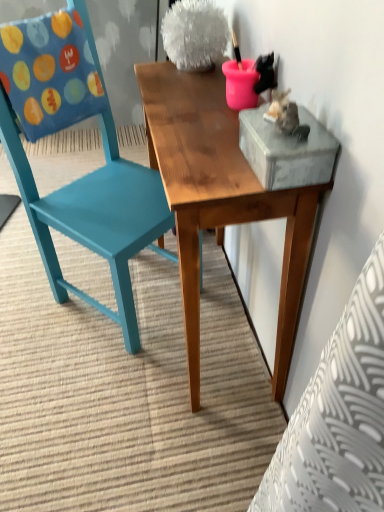
Find the location of a particular element. The image size is (384, 512). vacant space that's between wooden table at center and teal painted wood chair at left is located at coordinates (139, 364).